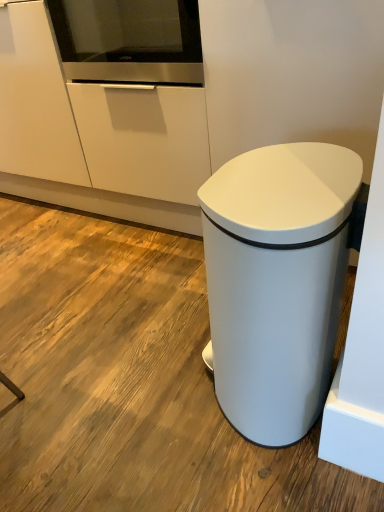
Question: From the image's perspective, is stainless steel oven at upper center located beneath white matte waste container at lower right?

Choices:
 (A) yes
 (B) no

Answer: (B)

Question: From the image's perspective, is stainless steel oven at upper center above white matte waste container at lower right?

Choices:
 (A) no
 (B) yes

Answer: (B)

Question: Does stainless steel oven at upper center have a smaller size compared to white matte waste container at lower right?

Choices:
 (A) no
 (B) yes

Answer: (B)

Question: Considering the relative sizes of stainless steel oven at upper center and white matte waste container at lower right in the image provided, is stainless steel oven at upper center shorter than white matte waste container at lower right?

Choices:
 (A) yes
 (B) no

Answer: (A)

Question: Does stainless steel oven at upper center have a greater width compared to white matte waste container at lower right?

Choices:
 (A) no
 (B) yes

Answer: (B)

Question: Does stainless steel oven at upper center have a lesser width compared to white matte waste container at lower right?

Choices:
 (A) yes
 (B) no

Answer: (B)

Question: Does white matte waste container at lower right come behind stainless steel oven at upper center?

Choices:
 (A) yes
 (B) no

Answer: (B)

Question: Is white matte waste container at lower right far from stainless steel oven at upper center?

Choices:
 (A) no
 (B) yes

Answer: (A)

Question: Is white matte waste container at lower right in contact with stainless steel oven at upper center?

Choices:
 (A) yes
 (B) no

Answer: (B)

Question: Is stainless steel oven at upper center inside white matte waste container at lower right?

Choices:
 (A) no
 (B) yes

Answer: (A)

Question: Considering the relative positions of white matte waste container at lower right and stainless steel oven at upper center in the image provided, is white matte waste container at lower right to the left of stainless steel oven at upper center from the viewer's perspective?

Choices:
 (A) no
 (B) yes

Answer: (A)

Question: Is white matte waste container at lower right closer to camera compared to stainless steel oven at upper center?

Choices:
 (A) no
 (B) yes

Answer: (B)

Question: Is white matte waste container at lower right inside or outside of stainless steel oven at upper center?

Choices:
 (A) outside
 (B) inside

Answer: (A)